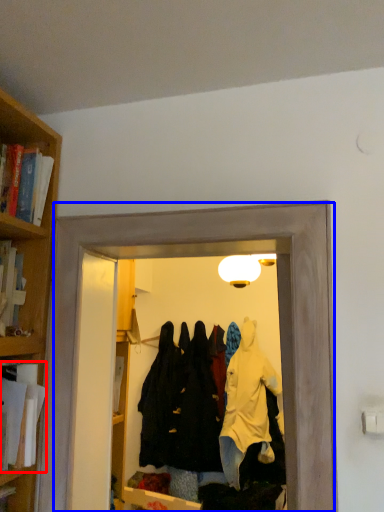
Question: Which object is closer to the camera taking this photo, book (highlighted by a red box) or glass door (highlighted by a blue box)?

Choices:
 (A) book
 (B) glass door

Answer: (B)